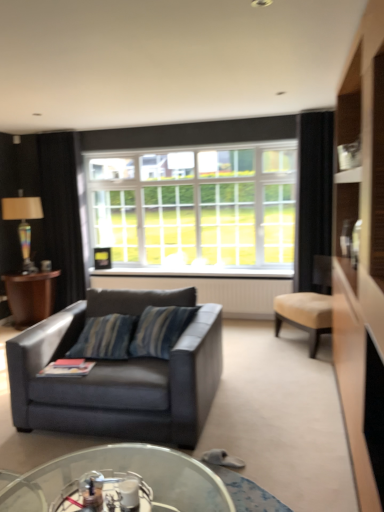
Question: Is white glass window at center smaller than wooden side table at left?

Choices:
 (A) yes
 (B) no

Answer: (B)

Question: Does white glass window at center appear on the right side of wooden side table at left?

Choices:
 (A) no
 (B) yes

Answer: (B)

Question: From a real-world perspective, is white glass window at center beneath wooden side table at left?

Choices:
 (A) yes
 (B) no

Answer: (B)

Question: From the image's perspective, would you say white glass window at center is positioned over wooden side table at left?

Choices:
 (A) no
 (B) yes

Answer: (B)

Question: Can we say white glass window at center lies outside wooden side table at left?

Choices:
 (A) no
 (B) yes

Answer: (B)

Question: Does white glass window at center come behind wooden side table at left?

Choices:
 (A) yes
 (B) no

Answer: (B)

Question: Is multicolored glass lamp at left at the left side of white textured radiator at center?

Choices:
 (A) yes
 (B) no

Answer: (A)

Question: Is multicolored glass lamp at left shorter than white textured radiator at center?

Choices:
 (A) yes
 (B) no

Answer: (B)

Question: Can you confirm if multicolored glass lamp at left is bigger than white textured radiator at center?

Choices:
 (A) no
 (B) yes

Answer: (A)

Question: Does multicolored glass lamp at left touch white textured radiator at center?

Choices:
 (A) no
 (B) yes

Answer: (A)

Question: Can white textured radiator at center be found inside multicolored glass lamp at left?

Choices:
 (A) yes
 (B) no

Answer: (B)

Question: Is white textured radiator at center at the back of multicolored glass lamp at left?

Choices:
 (A) no
 (B) yes

Answer: (A)

Question: Is transparent glass coffee table at lower center not near multicolored glass lamp at left?

Choices:
 (A) yes
 (B) no

Answer: (A)